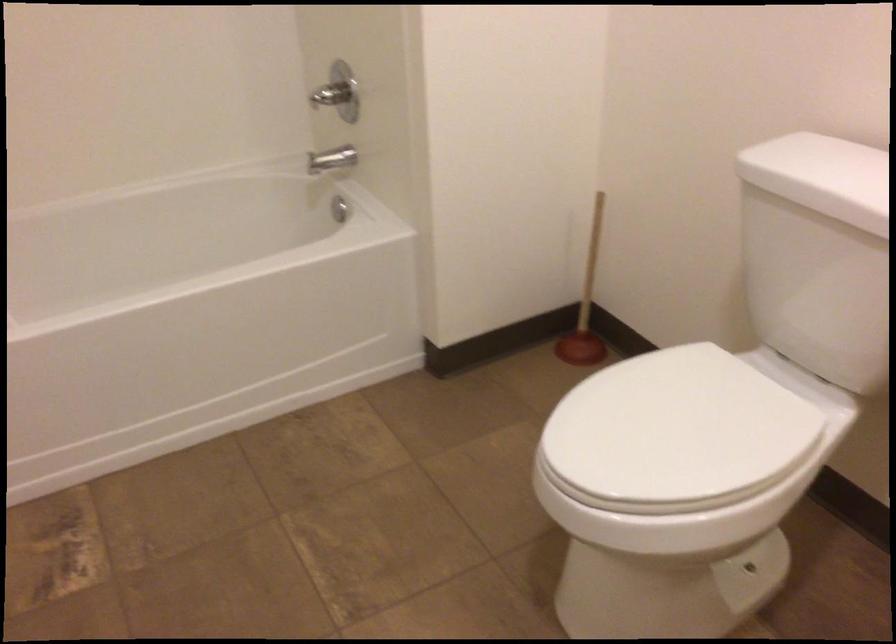
What do you see at coordinates (332, 160) in the screenshot?
I see `a faucet diverter switch` at bounding box center [332, 160].